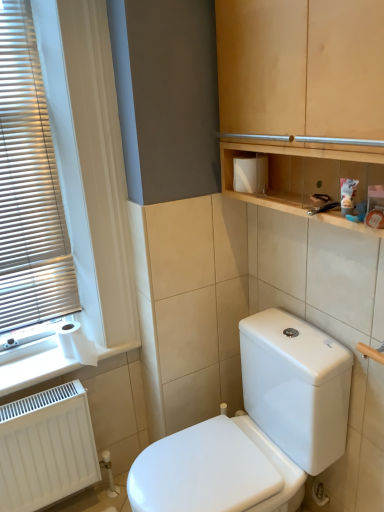
You are a GUI agent. You are given a task and a screenshot of the screen. Output one action in this format:
    pyautogui.click(x=<x>, y=<y>)
    Task: Click on the blank space above white matte radiator at lower left (from a real-world perspective)
    
    Given the screenshot: What is the action you would take?
    pyautogui.click(x=41, y=397)